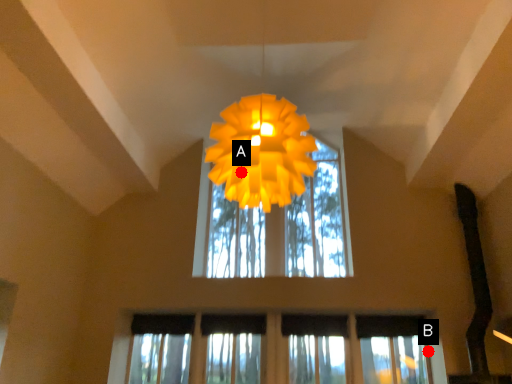
Question: Two points are circled on the image, labeled by A and B beside each circle. Among these points, which one is farthest from the camera?

Choices:
 (A) A is further
 (B) B is further

Answer: (B)